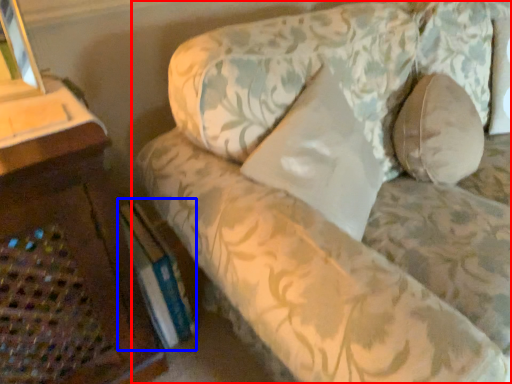
Question: Among these objects, which one is farthest to the camera, studio couch (highlighted by a red box) or paperback book (highlighted by a blue box)?

Choices:
 (A) studio couch
 (B) paperback book

Answer: (B)